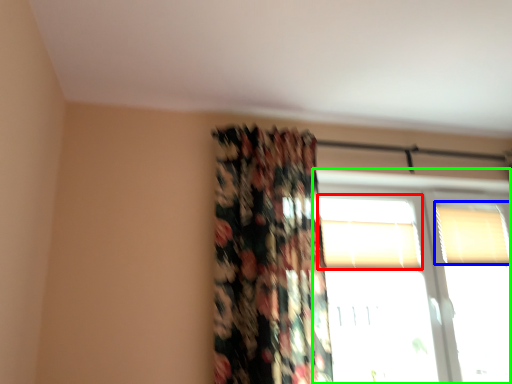
Question: Which object is the closest to the window (highlighted by a red box)? Choose among these: window (highlighted by a blue box) or window (highlighted by a green box).

Choices:
 (A) window
 (B) window

Answer: (B)